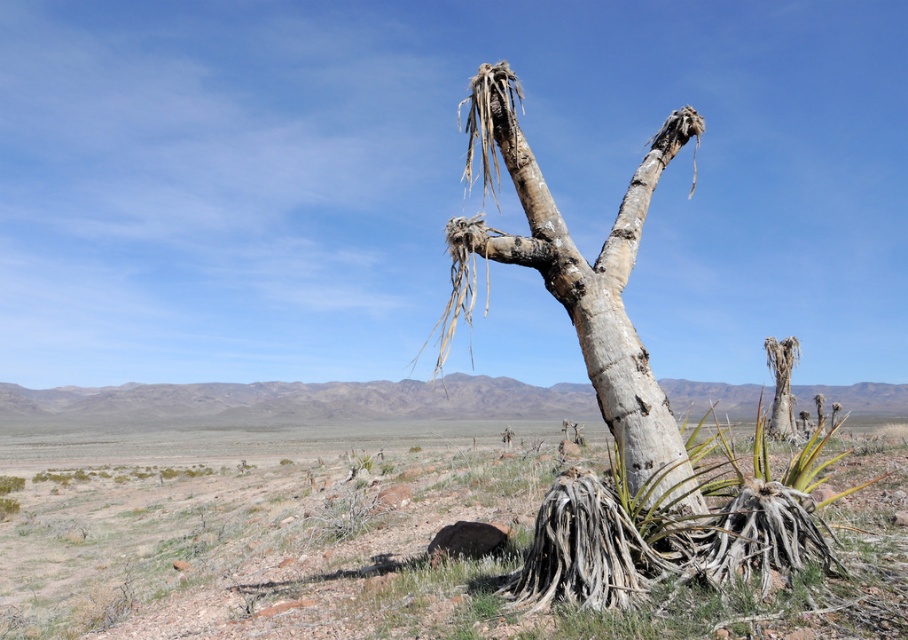
You are a desert explorer who needs to cross from the desert soil at center to the gray bark tree at center. Can you walk directly between them without any obstacles?

The distance between desert soil at center and gray bark tree at center is 33.69 feet, so yes, you can walk directly between them without any obstacles since there is no mention of obstacles in the scene description.

You are standing in the desert and see the desert soil at center and the gray bark tree at center. Which object is nearer to you?

The desert soil at center is closer to the viewer than the gray bark tree at center.

You are a desert explorer trying to navigate through the desert. You see the desert soil at center and the gray bark tree at center. Which object is taller from the ground up?

The gray bark tree at center is taller than the desert soil at center.